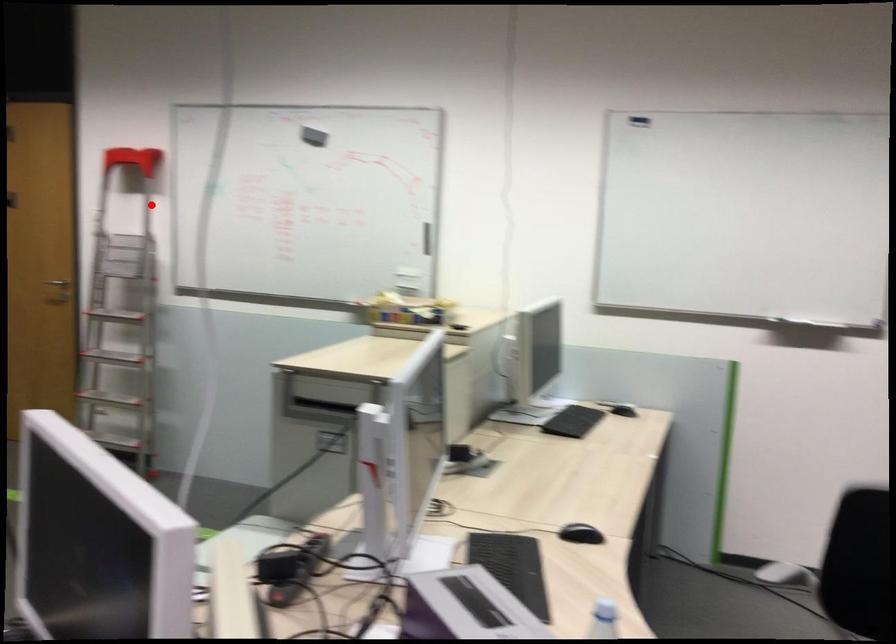
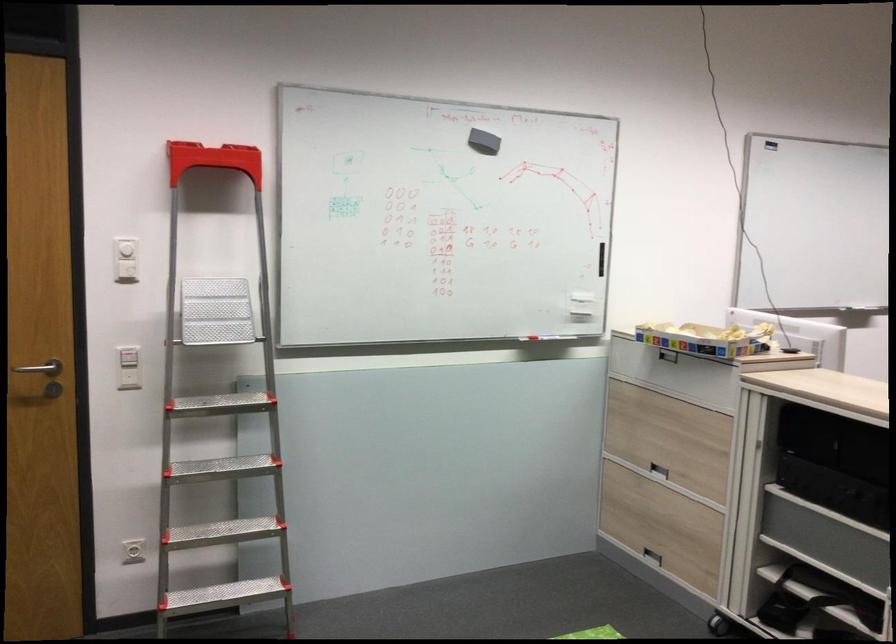
In the second image, find the point that corresponds to the highlighted location in the first image.

(125, 249)